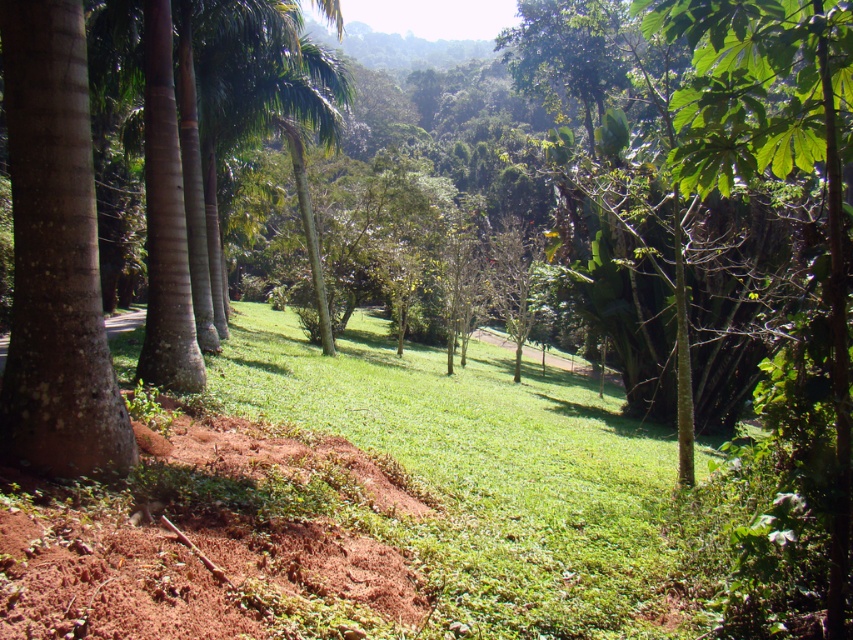
Does green grassy at center appear under smooth brown palm tree at left?

Yes, green grassy at center is below smooth brown palm tree at left.

Between point (369, 371) and point (190, 112), which one is positioned behind?

The point (369, 371) is behind.

Locate an element on the screen. Image resolution: width=853 pixels, height=640 pixels. green grassy at center is located at coordinates pyautogui.click(x=489, y=474).